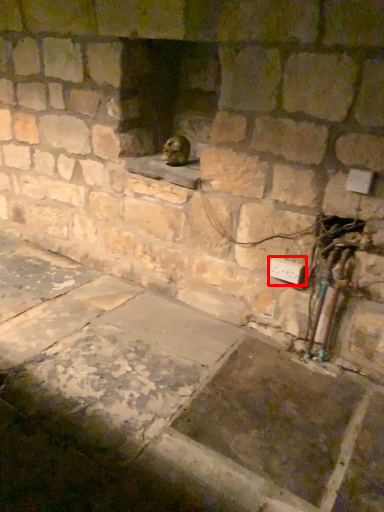
Question: Where is electric outlet (annotated by the red box) located in relation to animal in the image?

Choices:
 (A) left
 (B) right

Answer: (B)